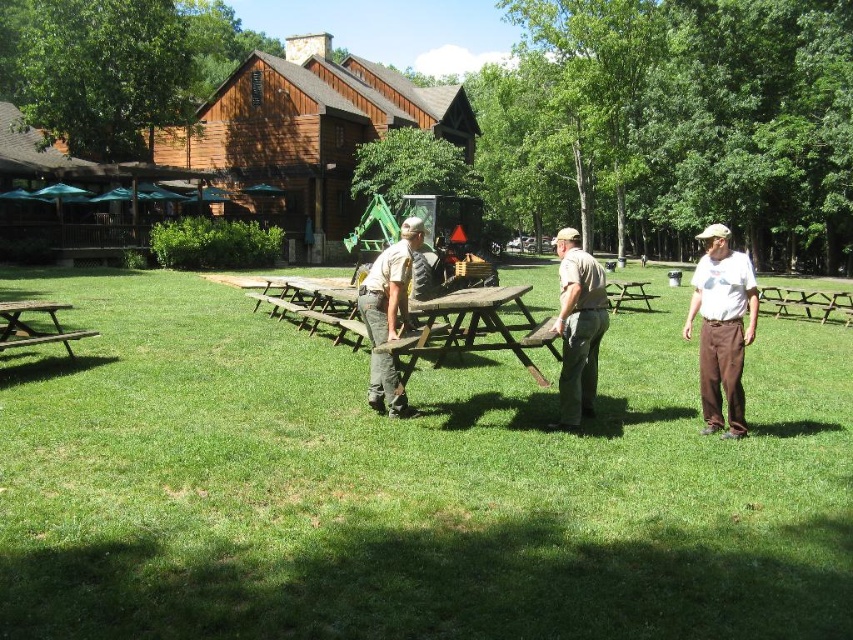
You are standing in the park and want to place a small flag exactly where the green grass at center and brown wood picnic table at center meet. Which object will the flag be closer to?

The flag will be closer to the green grass at center because it is positioned closer to the viewer than the brown wood picnic table at center.

You are a park visitor observing two people at the picnic tables. You notice the khaki uniform pants at center and the white cotton shirt at center. Which of these two items is taller?

The khaki uniform pants at center is taller than the white cotton shirt at center.